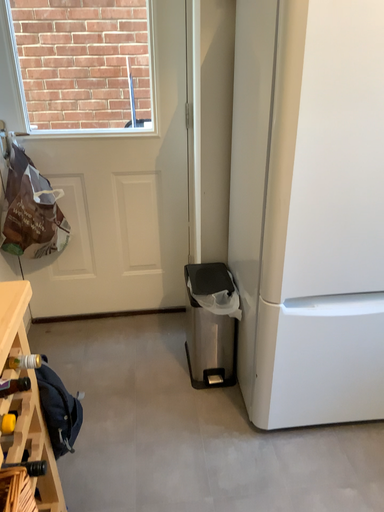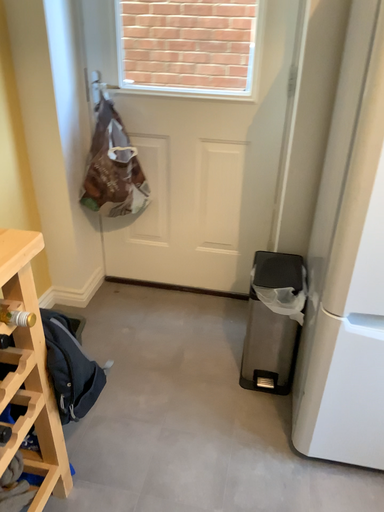
Question: Which way did the camera rotate in the video?

Choices:
 (A) rotated right
 (B) rotated left

Answer: (B)